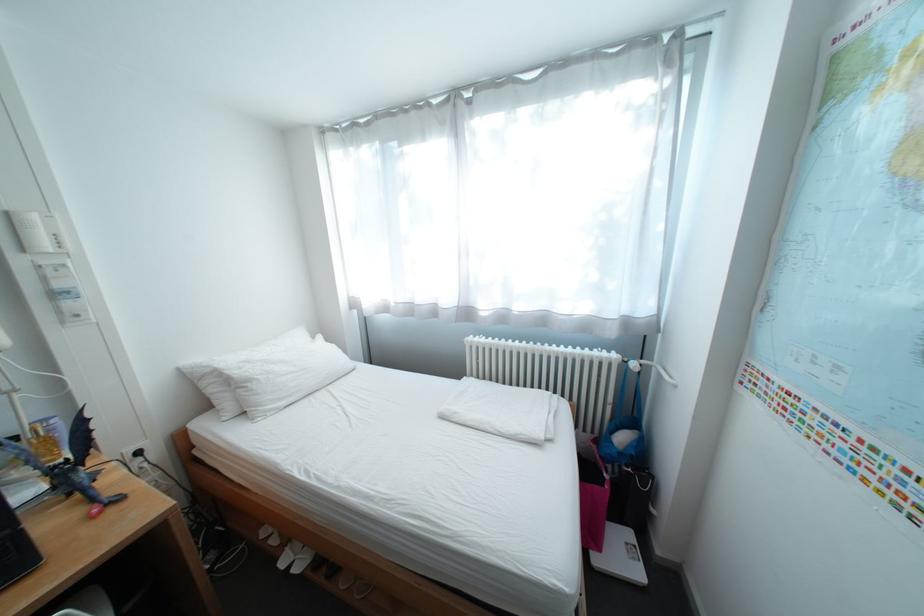
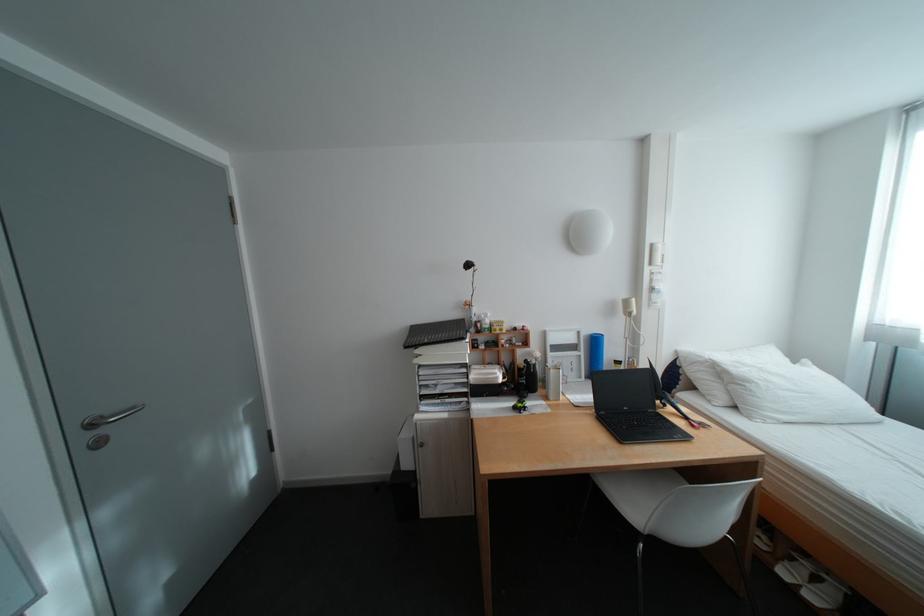
In the second image, find the point that corresponds to the point at 263,383 in the first image.

(761, 384)